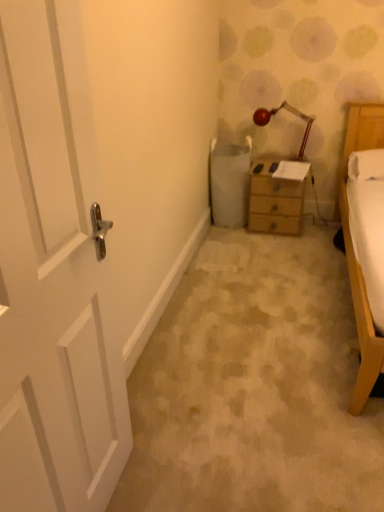
In order to face matte red lamp at upper right, should I rotate leftwards or rightwards?

Turn right by 11.763 degrees to look at matte red lamp at upper right.

Consider the image. What is the approximate height of wooden nightstand at center?

wooden nightstand at center is 18.90 inches in height.

Image resolution: width=384 pixels, height=512 pixels. In order to click on matte red lamp at upper right in this screenshot , I will do (290, 112).

Which is more to the left, white soft pillow at right or white wooden door at left?

From the viewer's perspective, white wooden door at left appears more on the left side.

Is white soft pillow at right far from white wooden door at left?

Yes.

Is white wooden door at left a part of white soft pillow at right?

No, white wooden door at left is not inside white soft pillow at right.

Locate an element on the screen. This screenshot has width=384, height=512. door on the left of white soft pillow at right is located at coordinates pyautogui.click(x=54, y=275).

Is wooden nightstand at center taller or shorter than white wooden door at left?

Considering their sizes, wooden nightstand at center has less height than white wooden door at left.

From the picture: Does wooden nightstand at center have a greater width compared to white wooden door at left?

Indeed, wooden nightstand at center has a greater width compared to white wooden door at left.

Who is bigger, wooden nightstand at center or white wooden door at left?

With larger size is wooden nightstand at center.

Considering the positions of objects wooden nightstand at center and white wooden door at left in the image provided, who is more to the left, wooden nightstand at center or white wooden door at left?

white wooden door at left is more to the left.

Who is bigger, wooden nightstand at center or matte red lamp at upper right?

Bigger between the two is wooden nightstand at center.

Are wooden nightstand at center and matte red lamp at upper right located far from each other?

No, wooden nightstand at center is in close proximity to matte red lamp at upper right.

Image resolution: width=384 pixels, height=512 pixels. What are the coordinates of `lamp above the wooden nightstand at center (from a real-world perspective)` in the screenshot? It's located at (290, 112).

Considering the positions of points (298, 114) and (293, 232), is point (298, 114) closer to camera compared to point (293, 232)?

No, (298, 114) is behind (293, 232).

Is there a large distance between matte red lamp at upper right and wooden nightstand at center?

No, there isn't a large distance between matte red lamp at upper right and wooden nightstand at center.

Who is shorter, matte red lamp at upper right or wooden nightstand at center?

matte red lamp at upper right.

Consider the image. From the image's perspective, is wooden nightstand at center positioned above or below white soft pillow at right?

wooden nightstand at center is below white soft pillow at right.

Is wooden nightstand at center located outside white soft pillow at right?

Indeed, wooden nightstand at center is completely outside white soft pillow at right.

Between point (263, 183) and point (364, 177), which one is positioned in front?

Point (364, 177)

In the scene shown: How many degrees apart are the facing directions of wooden nightstand at center and white soft pillow at right?

The facing directions of wooden nightstand at center and white soft pillow at right are 0.0236 degrees apart.

How many degrees apart are the facing directions of white soft pillow at right and matte red lamp at upper right?

12.8 degrees separate the facing orientations of white soft pillow at right and matte red lamp at upper right.

Can you confirm if white soft pillow at right is shorter than matte red lamp at upper right?

Indeed, white soft pillow at right has a lesser height compared to matte red lamp at upper right.

Locate an element on the screen. The width and height of the screenshot is (384, 512). pillow in front of the matte red lamp at upper right is located at coordinates (366, 165).

Based on the photo, which is behind, white wooden door at left or white soft pillow at right?

white soft pillow at right.

Is white soft pillow at right surrounded by white wooden door at left?

No, white soft pillow at right is located outside of white wooden door at left.

Between white wooden door at left and white soft pillow at right, which one has smaller width?

white wooden door at left is thinner.

Identify the location of pillow on the right of the white wooden door at left. (366, 165).

Image resolution: width=384 pixels, height=512 pixels. There is a wooden nightstand at center. What are the coordinates of `door above it (from a real-world perspective)` in the screenshot? It's located at (54, 275).

Looking at this image, from the image, which object appears to be nearer to white soft pillow at right, white wooden door at left or wooden nightstand at center?

wooden nightstand at center lies closer to white soft pillow at right than the other object.

When comparing their distances from matte red lamp at upper right, does wooden nightstand at center or white wooden door at left seem closer?

The object closer to matte red lamp at upper right is wooden nightstand at center.

From the image, which object appears to be farther from white wooden door at left, wooden nightstand at center or matte red lamp at upper right?

matte red lamp at upper right.

Based on their spatial positions, is white soft pillow at right or white wooden door at left further from matte red lamp at upper right?

white wooden door at left is positioned further to the anchor matte red lamp at upper right.

Estimate the real-world distances between objects in this image. Which object is further from matte red lamp at upper right, white wooden door at left or white soft pillow at right?

white wooden door at left lies further to matte red lamp at upper right than the other object.

Based on their spatial positions, is white soft pillow at right or white wooden door at left closer to wooden nightstand at center?

Based on the image, white soft pillow at right appears to be nearer to wooden nightstand at center.

When comparing their distances from wooden nightstand at center, does matte red lamp at upper right or white wooden door at left seem closer?

Among the two, matte red lamp at upper right is located nearer to wooden nightstand at center.

Based on their spatial positions, is matte red lamp at upper right or white wooden door at left closer to white soft pillow at right?

matte red lamp at upper right is closer to white soft pillow at right.

In order to click on nightstand between white wooden door at left and matte red lamp at upper right from front to back in this screenshot , I will do click(x=277, y=195).

Locate an element on the screen. The height and width of the screenshot is (512, 384). pillow positioned between white wooden door at left and matte red lamp at upper right from near to far is located at coordinates (366, 165).

Locate an element on the screen. lamp located between wooden nightstand at center and white soft pillow at right in the left-right direction is located at coordinates (290, 112).

Locate an element on the screen. The height and width of the screenshot is (512, 384). pillow between white wooden door at left and wooden nightstand at center from front to back is located at coordinates (366, 165).